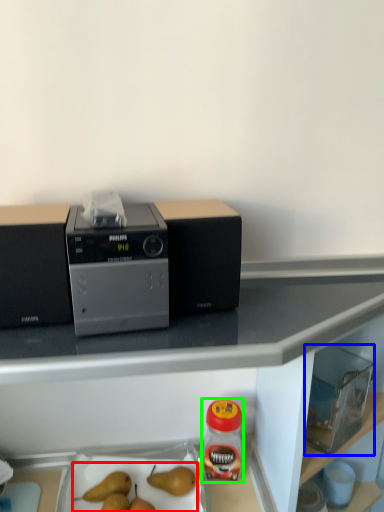
Question: Which is farther away from fruit (highlighted by a red box)? appliance (highlighted by a blue box) or bottle (highlighted by a green box)?

Choices:
 (A) appliance
 (B) bottle

Answer: (A)